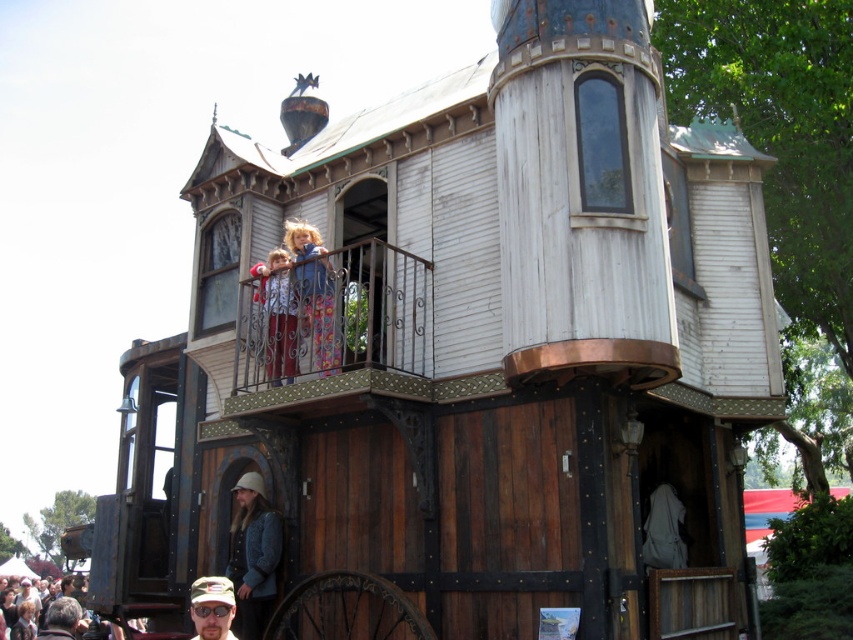
Question: Which object is the farthest from the matte gray jacket at lower left?

Choices:
 (A) white wrought iron balcony at upper center
 (B) denim jacket at lower center

Answer: (B)

Question: Estimate the real-world distances between objects in this image. Which object is farther from the white wrought iron balcony at upper center?

Choices:
 (A) camouflage fabric cap at lower center
 (B) matte gray jacket at lower left

Answer: (B)

Question: Can you confirm if denim jacket at lower center is positioned above camouflage fabric cap at lower center?

Choices:
 (A) yes
 (B) no

Answer: (B)

Question: Is white wrought iron balcony at upper center smaller than camouflage fabric cap at lower center?

Choices:
 (A) yes
 (B) no

Answer: (B)

Question: Where is denim jacket at lower center located in relation to camouflage fabric cap at lower center in the image?

Choices:
 (A) above
 (B) below

Answer: (B)

Question: Estimate the real-world distances between objects in this image. Which object is farther from the camouflage fabric cap at lower center?

Choices:
 (A) denim jacket at lower center
 (B) white wrought iron balcony at upper center
 (C) matte gray jacket at lower left

Answer: (C)